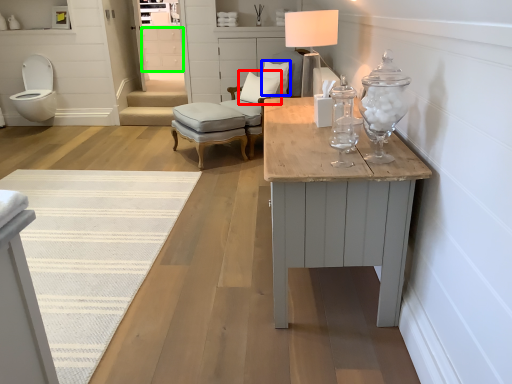
Question: Which is nearer to the pillow (highlighted by a red box)? pillow (highlighted by a blue box) or drawer (highlighted by a green box).

Choices:
 (A) pillow
 (B) drawer

Answer: (A)